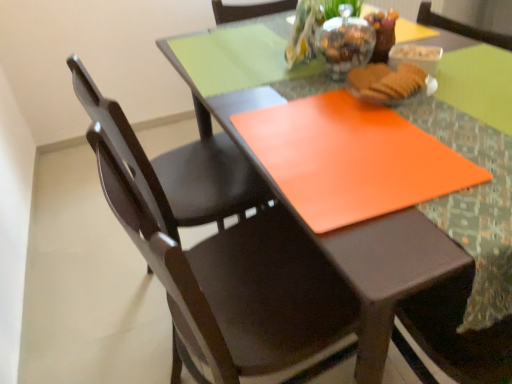
The height and width of the screenshot is (384, 512). What are the coordinates of `vacant space in front of matte brown biscuit at center` in the screenshot? It's located at (449, 125).